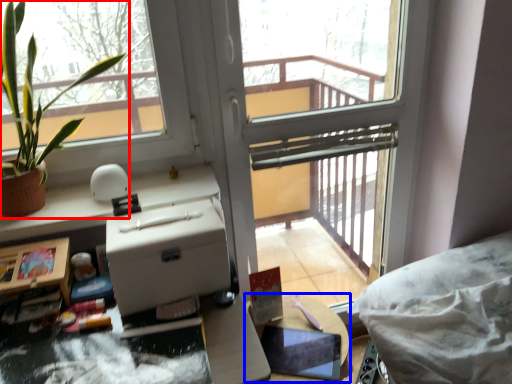
Question: Which point is closer to the camera, houseplant (highlighted by a red box) or table (highlighted by a blue box)?

Choices:
 (A) houseplant
 (B) table

Answer: (A)